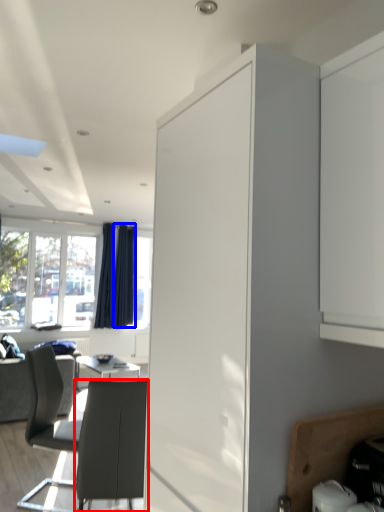
Question: Among these objects, which one is farthest to the camera, chair (highlighted by a red box) or curtain (highlighted by a blue box)?

Choices:
 (A) chair
 (B) curtain

Answer: (B)